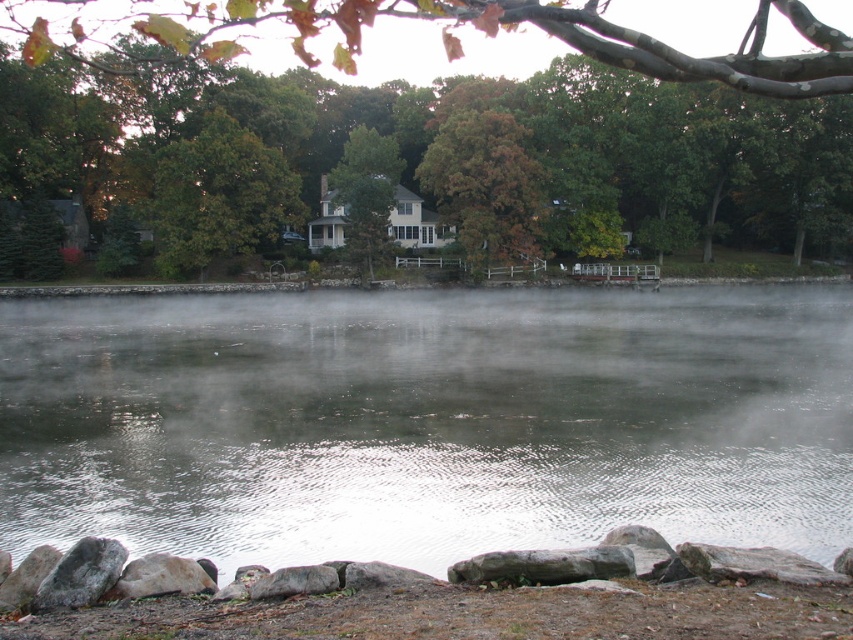
You are an artist trying to sketch this lakeside scene. You want to ensure the green leafy tree at center and the smooth gray rock at lower left are proportionally accurate. Which object should you draw wider in your sketch?

The green leafy tree at center should be drawn wider than the smooth gray rock at lower left because its width surpasses the rock.

From the picture: You are an observer standing on the lakeshore. You see the translucent misty water at center and the brown matte tree at upper center. Which object is positioned to the left of the other?

The translucent misty water at center is to the left of brown matte tree at upper center.

You are a hiker who has just arrived at the lakeside and wants to reach the gray rough rock at lower left from your current position near the green matte tree at center. Given that you can walk at 3 miles per hour, how long would it take you to reach the rock?

The distance between the green matte tree at center and the gray rough rock at lower left is 234.14 feet. Converting this to miles, 234.14 feet is approximately 0.044 miles. At a walking speed of 3 miles per hour, it would take roughly 0.88 minutes, or about 53 seconds to reach the rock.